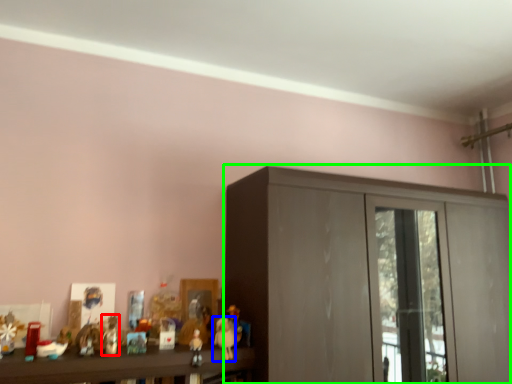
Question: Which is farther away from toy (highlighted by a red box)? toy (highlighted by a blue box) or cupboard (highlighted by a green box)?

Choices:
 (A) toy
 (B) cupboard

Answer: (B)